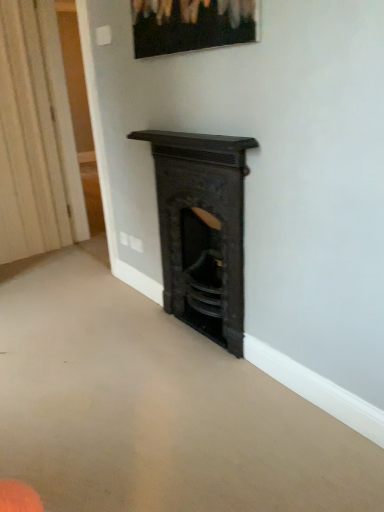
Question: Does white textured curtain at left have a lesser width compared to matte black picture frame at upper center?

Choices:
 (A) no
 (B) yes

Answer: (A)

Question: Is white textured curtain at left positioned before matte black picture frame at upper center?

Choices:
 (A) yes
 (B) no

Answer: (B)

Question: From the image's perspective, is white textured curtain at left below matte black picture frame at upper center?

Choices:
 (A) no
 (B) yes

Answer: (B)

Question: Is white textured curtain at left directly adjacent to matte black picture frame at upper center?

Choices:
 (A) no
 (B) yes

Answer: (A)

Question: From the image's perspective, does white textured curtain at left appear higher than matte black picture frame at upper center?

Choices:
 (A) yes
 (B) no

Answer: (B)

Question: Is matte black picture frame at upper center bigger or smaller than black cast iron fireplace at center?

Choices:
 (A) big
 (B) small

Answer: (B)

Question: Based on their positions, is matte black picture frame at upper center located to the left or right of black cast iron fireplace at center?

Choices:
 (A) left
 (B) right

Answer: (A)

Question: Is matte black picture frame at upper center inside or outside of black cast iron fireplace at center?

Choices:
 (A) outside
 (B) inside

Answer: (A)

Question: Looking at their shapes, would you say matte black picture frame at upper center is wider or thinner than black cast iron fireplace at center?

Choices:
 (A) wide
 (B) thin

Answer: (B)

Question: From the image's perspective, is black cast iron fireplace at center above or below white textured curtain at left?

Choices:
 (A) below
 (B) above

Answer: (A)

Question: Is black cast iron fireplace at center situated inside white textured curtain at left or outside?

Choices:
 (A) inside
 (B) outside

Answer: (B)

Question: Based on their sizes in the image, would you say black cast iron fireplace at center is bigger or smaller than white textured curtain at left?

Choices:
 (A) big
 (B) small

Answer: (A)

Question: In terms of height, does black cast iron fireplace at center look taller or shorter compared to white textured curtain at left?

Choices:
 (A) short
 (B) tall

Answer: (A)

Question: From a real-world perspective, relative to black cast iron fireplace at center, is white textured curtain at left vertically above or below?

Choices:
 (A) above
 (B) below

Answer: (A)

Question: Is white textured curtain at left wider or thinner than black cast iron fireplace at center?

Choices:
 (A) thin
 (B) wide

Answer: (A)